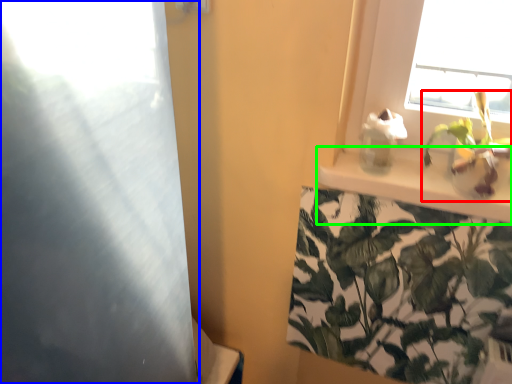
Question: Which object is the farthest from houseplant (highlighted by a red box)? Choose among these: screen door (highlighted by a blue box) or window sill (highlighted by a green box).

Choices:
 (A) screen door
 (B) window sill

Answer: (A)